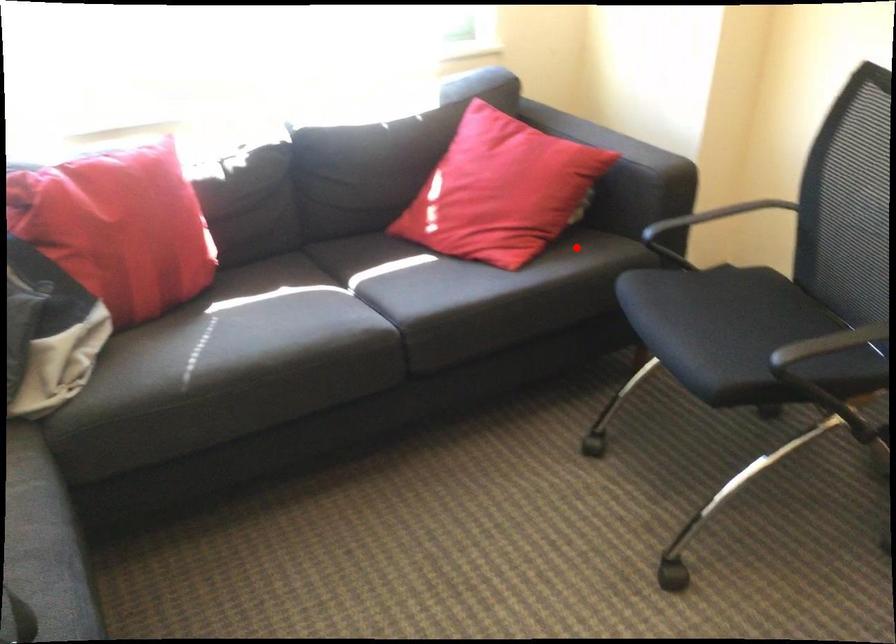
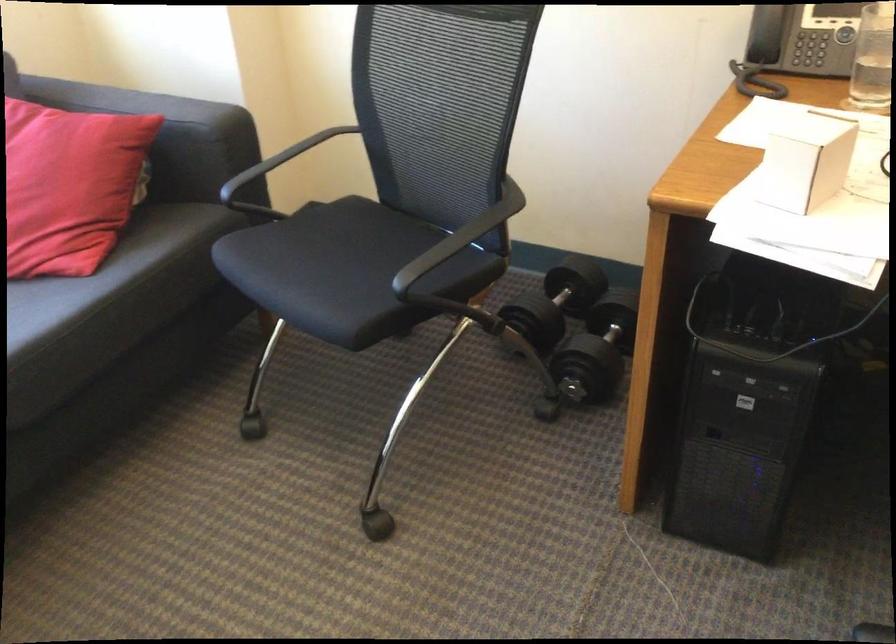
Question: I am providing you with two images of the same scene from different viewpoints. Given a red point in image1, look at the same physical point in image2. Is it:

Choices:
 (A) Closer to the viewpoint
 (B) Farther from the viewpoint

Answer: (A)